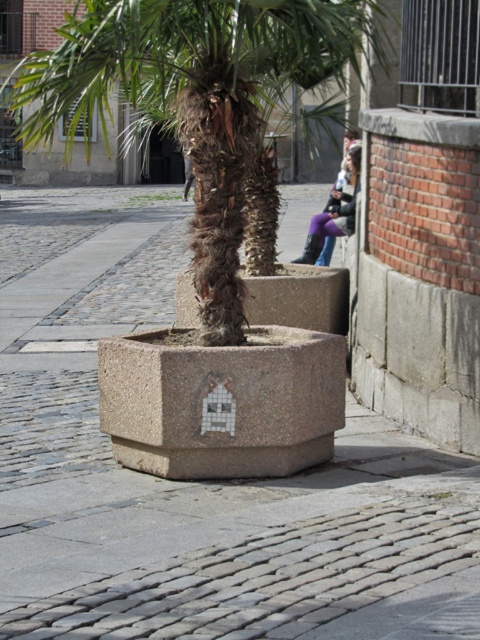
Question: Which of the following is the closest to the observer?

Choices:
 (A) purple denim jeans at upper center
 (B) green leafy palm tree at center

Answer: (B)

Question: Which object is the farthest from the green leafy palm tree at center?

Choices:
 (A) gray concrete planter at center
 (B) purple denim jeans at upper center

Answer: (A)

Question: Is gray concrete planter at center closer to the viewer compared to green leafy palm tree at center?

Choices:
 (A) no
 (B) yes

Answer: (B)

Question: Which point is closer to the camera?

Choices:
 (A) (275, 573)
 (B) (338, 204)
 (C) (24, 58)

Answer: (A)

Question: Observing the image, what is the correct spatial positioning of gray concrete planter at center in reference to green leafy palm tree at center?

Choices:
 (A) above
 (B) below

Answer: (B)

Question: Is green leafy palm tree at center positioned before purple denim jeans at upper center?

Choices:
 (A) no
 (B) yes

Answer: (B)